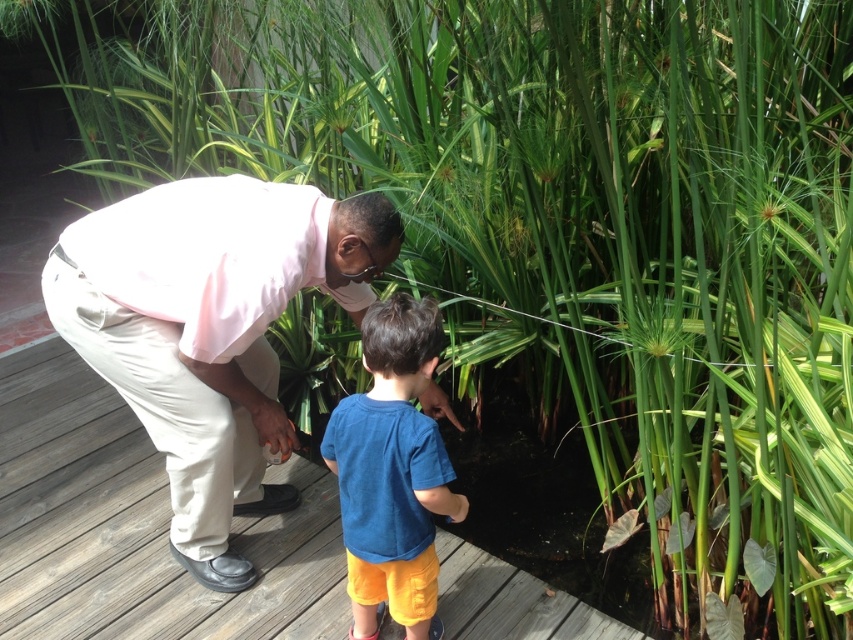
You are designing a garden layout and need to place both the wooden deck at center and the pink cotton shirt at center. Given their sizes, which object should you prioritize placing first to ensure there is enough space?

The wooden deck at center has a larger size compared to the pink cotton shirt at center, so you should prioritize placing the wooden deck at center first to ensure there is enough space.

You are a clothing designer observing the two shirts in the image. The pink cotton shirt at center and the blue cotton shirt at center. Which one has a greater width?

The pink cotton shirt at center has a greater width than the blue cotton shirt at center.